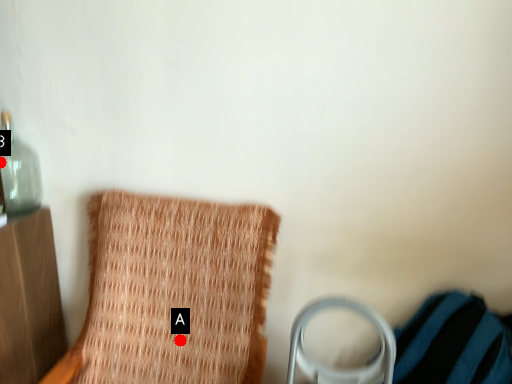
Question: Two points are circled on the image, labeled by A and B beside each circle. Which point is closer to the camera?

Choices:
 (A) A is closer
 (B) B is closer

Answer: (A)